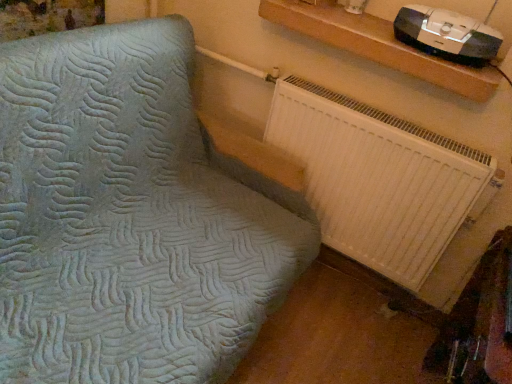
This screenshot has height=384, width=512. I want to click on blank space to the left of black plastic stereo at upper right, so click(369, 28).